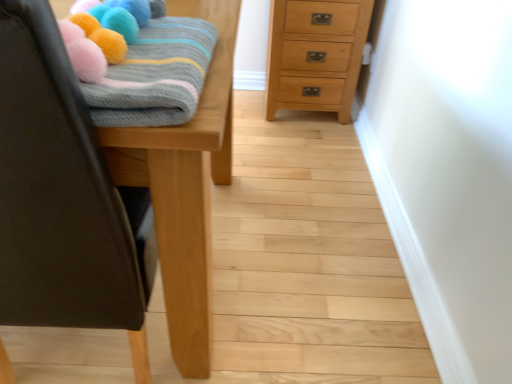
Find the location of `vacant space that is in between wooden table at left and natural wood chest of drawers at upper right`. vacant space that is in between wooden table at left and natural wood chest of drawers at upper right is located at coordinates (276, 182).